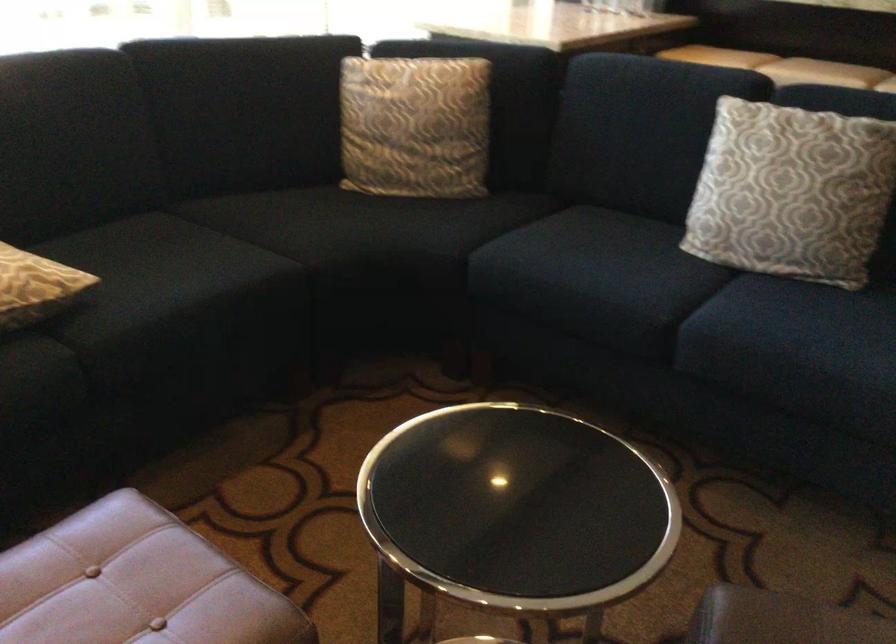
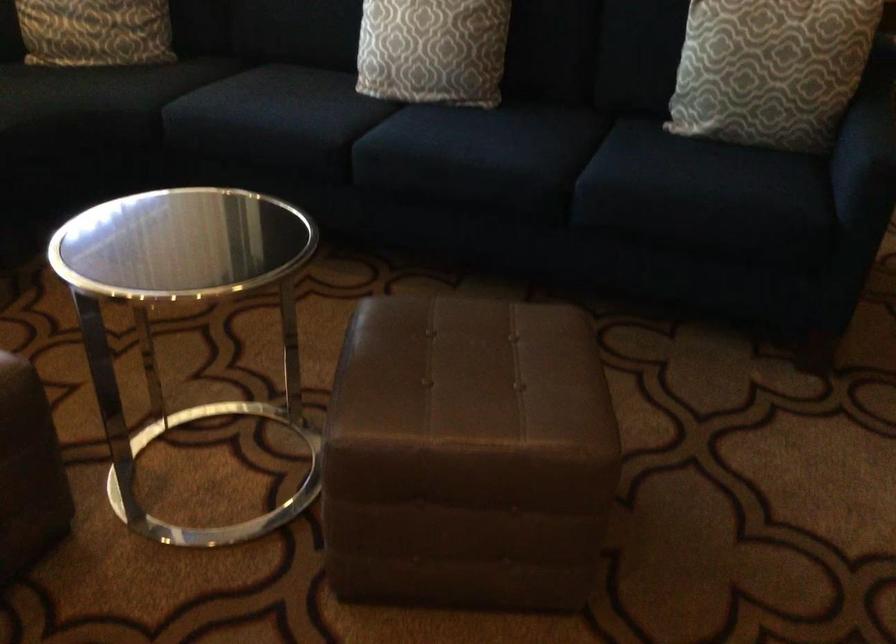
Question: How did the camera likely rotate?

Choices:
 (A) Left
 (B) Right
 (C) Up
 (D) Down

Answer: (B)